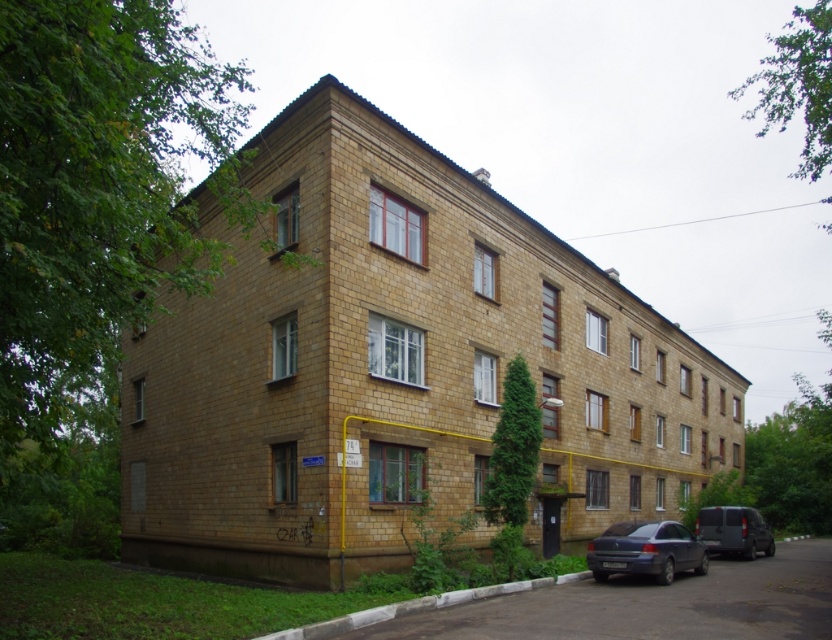
Question: Which of the following is the farthest from the observer?

Choices:
 (A) dark gray matte van at lower right
 (B) metallic blue sedan at lower right

Answer: (A)

Question: Is metallic blue sedan at lower right above dark gray matte van at lower right?

Choices:
 (A) no
 (B) yes

Answer: (B)

Question: Considering the relative positions of metallic blue sedan at lower right and dark gray matte van at lower right in the image provided, where is metallic blue sedan at lower right located with respect to dark gray matte van at lower right?

Choices:
 (A) above
 (B) below

Answer: (A)

Question: Which point appears closest to the camera in this image?

Choices:
 (A) (598, 544)
 (B) (722, 516)

Answer: (A)

Question: Is metallic blue sedan at lower right to the right of dark gray matte van at lower right from the viewer's perspective?

Choices:
 (A) no
 (B) yes

Answer: (A)